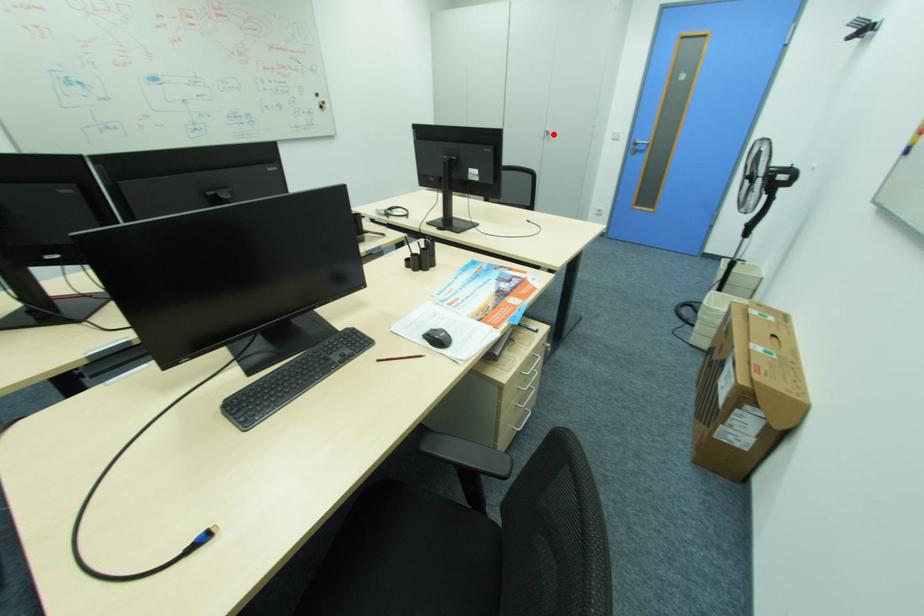
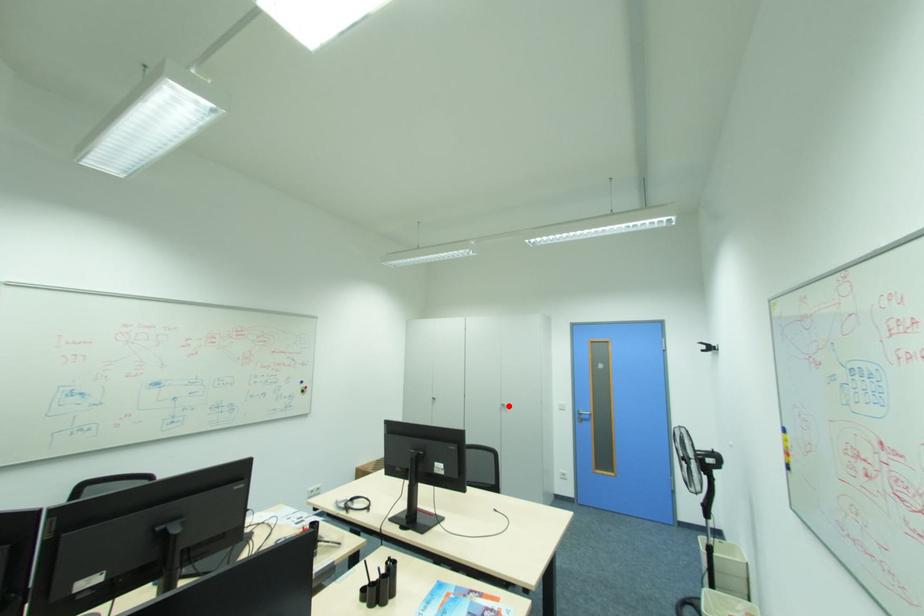
I am providing you with two images of the same scene from different viewpoints. A red point is marked on the first image and another point is marked on the second image. Is the red point in image1 aligned with the point shown in image2?

Yes